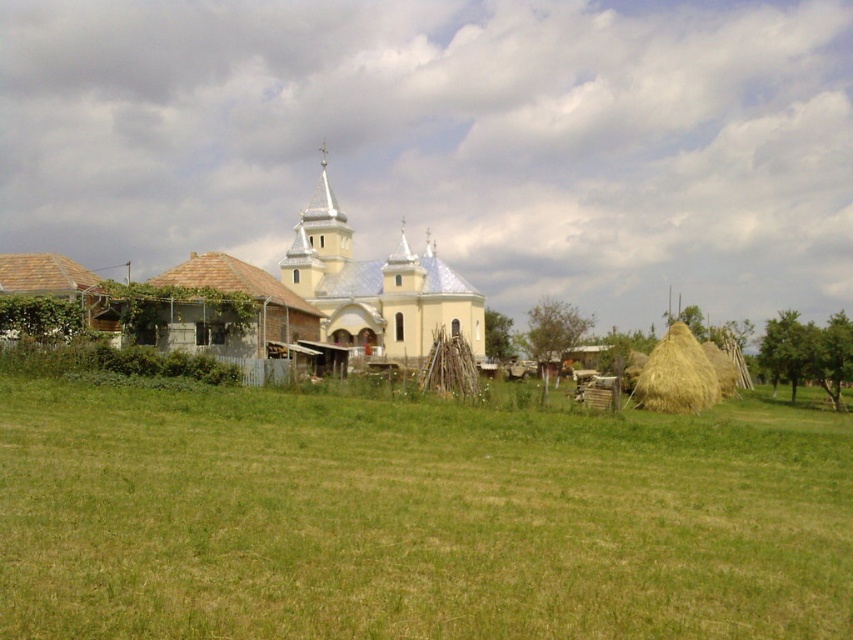
You are standing in the field looking towards the church. There are two points marked in the image. Which point, point (213, 493) or point (53, 298), is closer to you?

Point (213, 493) is closer to you than point (53, 298).

You are standing in the middle of the grassy field in front of the yellow matte church at center. You want to take a photo of the brown shingled hut at lower left without the church in the background. Which direction should you move to ensure the church is out of frame?

Move to the left side of the brown shingled hut at lower left so that the yellow matte church at center is no longer in the background.